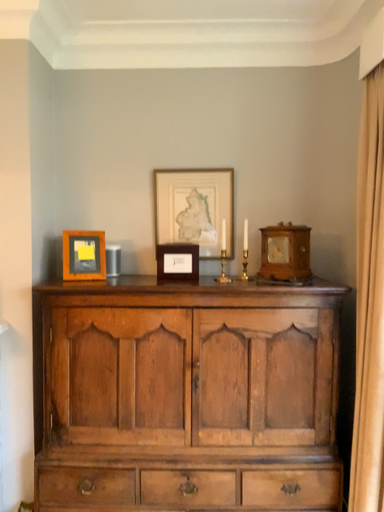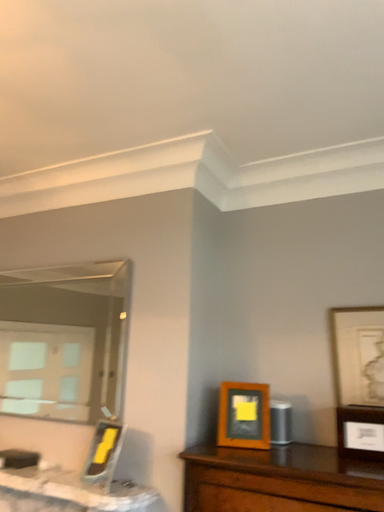
Question: How did the camera likely rotate when shooting the video?

Choices:
 (A) rotated right
 (B) rotated left

Answer: (B)